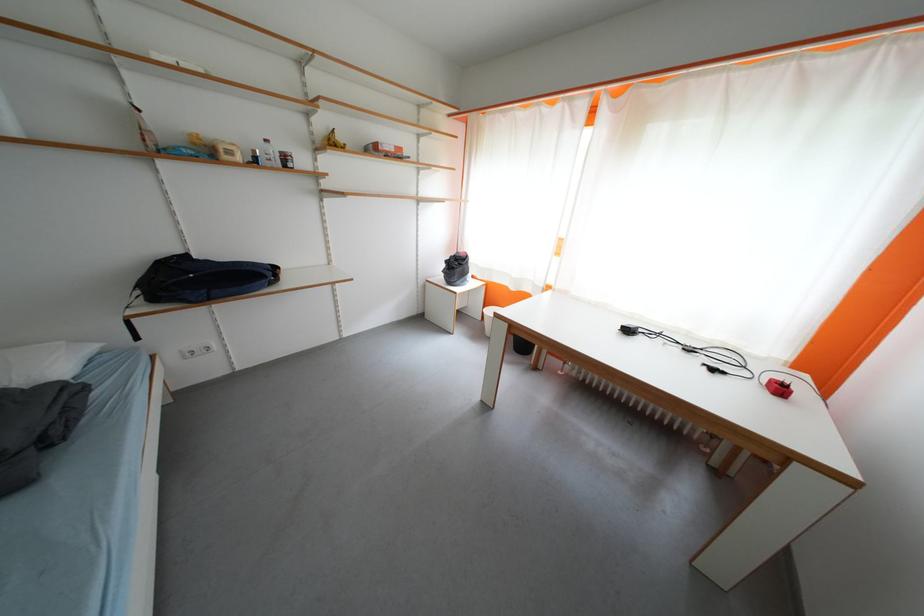
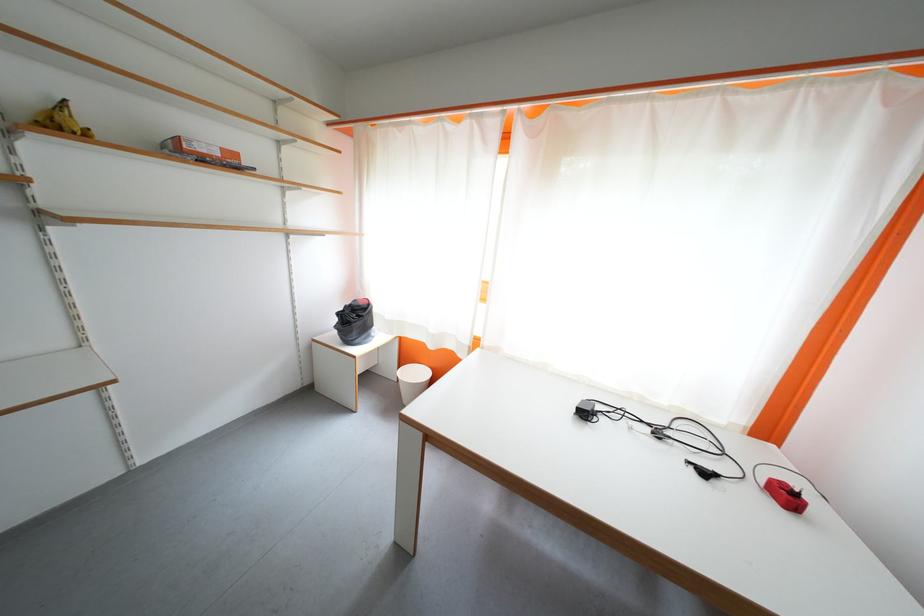
The point at (789, 392) is marked in the first image. Where is the corresponding point in the second image?

(796, 500)